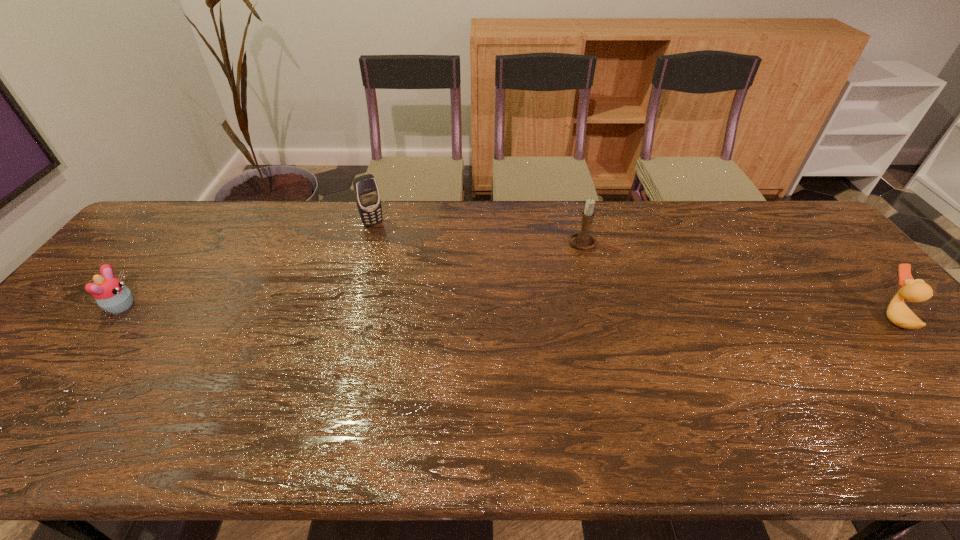
Image resolution: width=960 pixels, height=540 pixels. What are the coordinates of `free space between the rightmost object and the second object from right to left` in the screenshot? It's located at (736, 280).

This screenshot has height=540, width=960. I want to click on free space between the rightmost object and the second object from left to right, so click(633, 271).

Locate an element on the screen. The height and width of the screenshot is (540, 960). free spot between the third object from right to left and the cupcake is located at coordinates (247, 265).

The image size is (960, 540). I want to click on vacant area that lies between the rightmost object and the cellular telephone, so click(633, 271).

Find the location of a particular element. This screenshot has height=540, width=960. blank region between the cupcake and the cellular telephone is located at coordinates (247, 265).

Identify the location of free spot between the duck and the cupcake. (507, 312).

At what (x,y) coordinates should I click in order to perform the action: click on the third closest object to the farthest object. Please return your answer as a coordinate pair (x, y). The width and height of the screenshot is (960, 540). Looking at the image, I should click on (898, 312).

Locate which object ranks third in proximity to the farthest object. Please provide its 2D coordinates. Your answer should be formatted as a tuple, i.e. [(x, y)], where the tuple contains the x and y coordinates of a point satisfying the conditions above.

[(898, 312)]

I want to click on vacant position in the image that satisfies the following two spatial constraints: 1. on the front side of the rightmost object; 2. on the beak of the cellular telephone, so click(346, 317).

Where is `vacant region that satisfies the following two spatial constraints: 1. on the front side of the rightmost object; 2. on the beak of the candle holder`? The height and width of the screenshot is (540, 960). vacant region that satisfies the following two spatial constraints: 1. on the front side of the rightmost object; 2. on the beak of the candle holder is located at coordinates (600, 317).